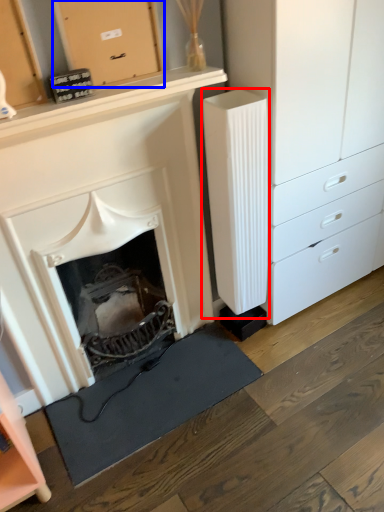
Question: Which of the following is the closest to the observer, appliance (highlighted by a red box) or cabinetry (highlighted by a blue box)?

Choices:
 (A) appliance
 (B) cabinetry

Answer: (B)